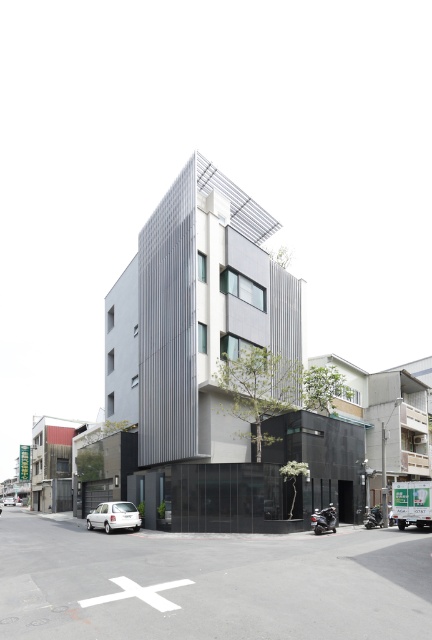
Question: Considering the relative positions of white matte car at lower left and white matte car at center in the image provided, where is white matte car at lower left located with respect to white matte car at center?

Choices:
 (A) above
 (B) below

Answer: (A)

Question: Does white matte car at lower left have a larger size compared to white matte car at center?

Choices:
 (A) yes
 (B) no

Answer: (B)

Question: Which point is farther to the camera?

Choices:
 (A) (117, 522)
 (B) (10, 497)

Answer: (B)

Question: Which point appears farthest from the camera in this image?

Choices:
 (A) (12, 497)
 (B) (139, 516)

Answer: (A)

Question: Can you confirm if white matte car at lower left is positioned below white matte car at center?

Choices:
 (A) yes
 (B) no

Answer: (B)